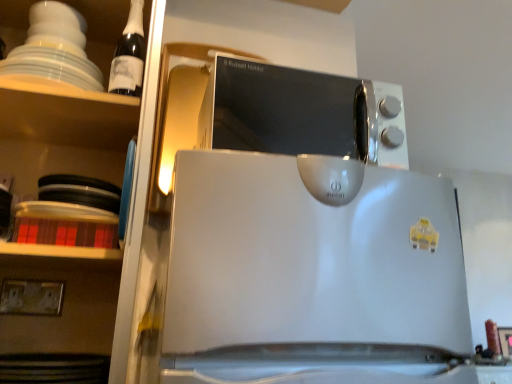
What is the approximate height of dark glass bottle at upper left?

dark glass bottle at upper left is 12.38 inches tall.

Locate an element on the screen. white plastic electric outlet at lower left is located at coordinates (x=31, y=298).

The height and width of the screenshot is (384, 512). Identify the location of satin silver microwave at upper center. click(300, 113).

What are the coordinates of `bottle lying in front of the white plastic electric outlet at lower left` in the screenshot? It's located at (129, 55).

From the image's perspective, does white plastic electric outlet at lower left appear lower than dark glass bottle at upper left?

Indeed, from the image's perspective, white plastic electric outlet at lower left is shown beneath dark glass bottle at upper left.

Considering the sizes of white plastic electric outlet at lower left and dark glass bottle at upper left in the image, is white plastic electric outlet at lower left bigger or smaller than dark glass bottle at upper left?

Considering their sizes, white plastic electric outlet at lower left takes up less space than dark glass bottle at upper left.

Is white plastic electric outlet at lower left at the left side of dark glass bottle at upper left?

Indeed, white plastic electric outlet at lower left is positioned on the left side of dark glass bottle at upper left.

Is white glossy shelves at upper left inside or outside of white plastic electric outlet at lower left?

The correct answer is: outside.

Considering the relative sizes of white glossy shelves at upper left and white plastic electric outlet at lower left in the image provided, is white glossy shelves at upper left smaller than white plastic electric outlet at lower left?

No.

Between white glossy shelves at upper left and white plastic electric outlet at lower left, which one is positioned behind?

white plastic electric outlet at lower left is further away from the camera.

Is white glossy shelves at upper left facing towards white plastic electric outlet at lower left?

Yes, white glossy shelves at upper left is aimed at white plastic electric outlet at lower left.

From a real-world perspective, does white glossy shelves at upper left sit lower than satin silver microwave at upper center?

No.

Between white glossy shelves at upper left and satin silver microwave at upper center, which one has larger size?

white glossy shelves at upper left is bigger.

From the image's perspective, who appears lower, white glossy shelves at upper left or satin silver microwave at upper center?

satin silver microwave at upper center, from the image's perspective.

Does white plastic electric outlet at lower left have a greater width compared to satin silver microwave at upper center?

Incorrect, the width of white plastic electric outlet at lower left does not surpass that of satin silver microwave at upper center.

From the image's perspective, is white plastic electric outlet at lower left positioned above or below satin silver microwave at upper center?

Based on their image positions, white plastic electric outlet at lower left is located beneath satin silver microwave at upper center.

From a real-world perspective, is white plastic electric outlet at lower left positioned over satin silver microwave at upper center based on gravity?

Incorrect, from a real-world perspective, white plastic electric outlet at lower left is lower than satin silver microwave at upper center.

From the picture: From the image's perspective, is white plastic electric outlet at lower left on top of white glossy shelves at upper left?

Actually, white plastic electric outlet at lower left appears below white glossy shelves at upper left in the image.

Is white plastic electric outlet at lower left at the left side of white glossy shelves at upper left?

Correct, you'll find white plastic electric outlet at lower left to the left of white glossy shelves at upper left.

Between white plastic electric outlet at lower left and white glossy shelves at upper left, which one has larger size?

With larger size is white glossy shelves at upper left.

From a real-world perspective, who is located higher, white plastic electric outlet at lower left or white glossy shelves at upper left?

white glossy shelves at upper left is physically above.

From a real-world perspective, is white glossy shelves at upper left on dark glass bottle at upper left?

No, from a real-world perspective, white glossy shelves at upper left is not above dark glass bottle at upper left.

Between white glossy shelves at upper left and dark glass bottle at upper left, which one has larger width?

With larger width is white glossy shelves at upper left.

The height and width of the screenshot is (384, 512). I want to click on bottle lying behind the white glossy shelves at upper left, so click(129, 55).

Which of these two, satin silver microwave at upper center or white plastic electric outlet at lower left, is wider?

satin silver microwave at upper center.

Can you confirm if satin silver microwave at upper center is positioned to the left of white plastic electric outlet at lower left?

In fact, satin silver microwave at upper center is to the right of white plastic electric outlet at lower left.

From the image's perspective, which is above, satin silver microwave at upper center or white plastic electric outlet at lower left?

From the image's view, satin silver microwave at upper center is above.

Is the depth of satin silver microwave at upper center less than that of white plastic electric outlet at lower left?

Yes, satin silver microwave at upper center is closer to the camera.

At what (x,y) coordinates should I click in order to perform the action: click on bottle on the right of white plastic electric outlet at lower left. Please return your answer as a coordinate pair (x, y). The width and height of the screenshot is (512, 384). Looking at the image, I should click on (129, 55).

This screenshot has height=384, width=512. What are the coordinates of `electric outlet lying on the left of white glossy shelves at upper left` in the screenshot? It's located at click(31, 298).

From the image, which object appears to be farther from dark glass bottle at upper left, white glossy shelves at upper left or white plastic electric outlet at lower left?

white plastic electric outlet at lower left lies further to dark glass bottle at upper left than the other object.

From the image, which object appears to be farther from white glossy shelves at upper left, dark glass bottle at upper left or white plastic electric outlet at lower left?

The object further to white glossy shelves at upper left is white plastic electric outlet at lower left.

Based on their spatial positions, is white plastic electric outlet at lower left or satin silver microwave at upper center further from dark glass bottle at upper left?

satin silver microwave at upper center is further to dark glass bottle at upper left.

Looking at this image, when comparing their distances from white plastic electric outlet at lower left, does white glossy shelves at upper left or satin silver microwave at upper center seem further?

Among the two, satin silver microwave at upper center is located further to white plastic electric outlet at lower left.

Considering their positions, is white glossy shelves at upper left positioned closer to satin silver microwave at upper center than dark glass bottle at upper left?

white glossy shelves at upper left is closer to satin silver microwave at upper center.

Which object lies further to the anchor point white glossy shelves at upper left, white plastic electric outlet at lower left or satin silver microwave at upper center?

satin silver microwave at upper center is positioned further to the anchor white glossy shelves at upper left.

From the image, which object appears to be nearer to white glossy shelves at upper left, white plastic electric outlet at lower left or dark glass bottle at upper left?

Among the two, dark glass bottle at upper left is located nearer to white glossy shelves at upper left.

Looking at the image, which one is located further to dark glass bottle at upper left, satin silver microwave at upper center or white plastic electric outlet at lower left?

Among the two, satin silver microwave at upper center is located further to dark glass bottle at upper left.

In order to click on shelf between dark glass bottle at upper left and white plastic electric outlet at lower left vertically in this screenshot , I will do `click(77, 123)`.

At what (x,y) coordinates should I click in order to perform the action: click on bottle between white plastic electric outlet at lower left and satin silver microwave at upper center. Please return your answer as a coordinate pair (x, y). Looking at the image, I should click on (129, 55).

The height and width of the screenshot is (384, 512). I want to click on shelf between white plastic electric outlet at lower left and satin silver microwave at upper center, so click(x=77, y=123).

Where is `bottle situated between white glossy shelves at upper left and satin silver microwave at upper center from left to right`? Image resolution: width=512 pixels, height=384 pixels. bottle situated between white glossy shelves at upper left and satin silver microwave at upper center from left to right is located at coordinates (129, 55).